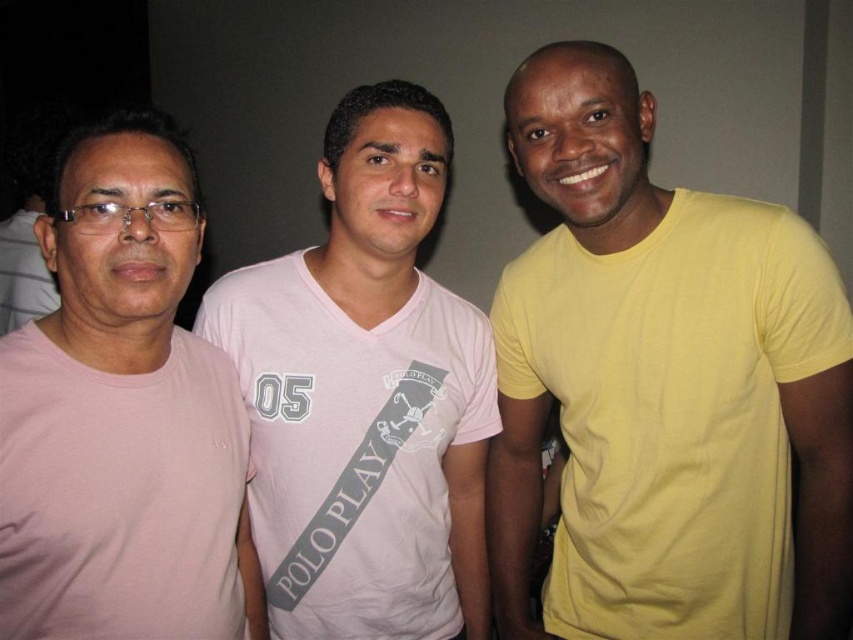
Does point (537, 429) lie behind point (109, 173)?

Yes, point (537, 429) is farther from viewer.

Is yellow matte t-shirt at right thinner than pink matte t-shirt at left?

In fact, yellow matte t-shirt at right might be wider than pink matte t-shirt at left.

Which is in front, point (496, 509) or point (90, 280)?

Point (90, 280) is in front.

Where is `yellow matte t-shirt at right`? yellow matte t-shirt at right is located at coordinates (663, 385).

Does pink cotton t-shirt at center have a larger size compared to pink matte t-shirt at left?

Yes.

You are a GUI agent. You are given a task and a screenshot of the screen. Output one action in this format:
    pyautogui.click(x=<x>, y=<y>)
    Task: Click on the pink cotton t-shirt at center
    Image resolution: width=853 pixels, height=640 pixels.
    Given the screenshot: What is the action you would take?
    pyautogui.click(x=364, y=394)

The width and height of the screenshot is (853, 640). I want to click on pink cotton t-shirt at center, so click(x=364, y=394).

Can you confirm if yellow matte t-shirt at right is shorter than pink cotton t-shirt at center?

Incorrect, yellow matte t-shirt at right's height does not fall short of pink cotton t-shirt at center's.

Which is behind, point (585, 536) or point (415, 344)?

Positioned behind is point (585, 536).

Find the location of a particular element. This screenshot has height=640, width=853. yellow matte t-shirt at right is located at coordinates (663, 385).